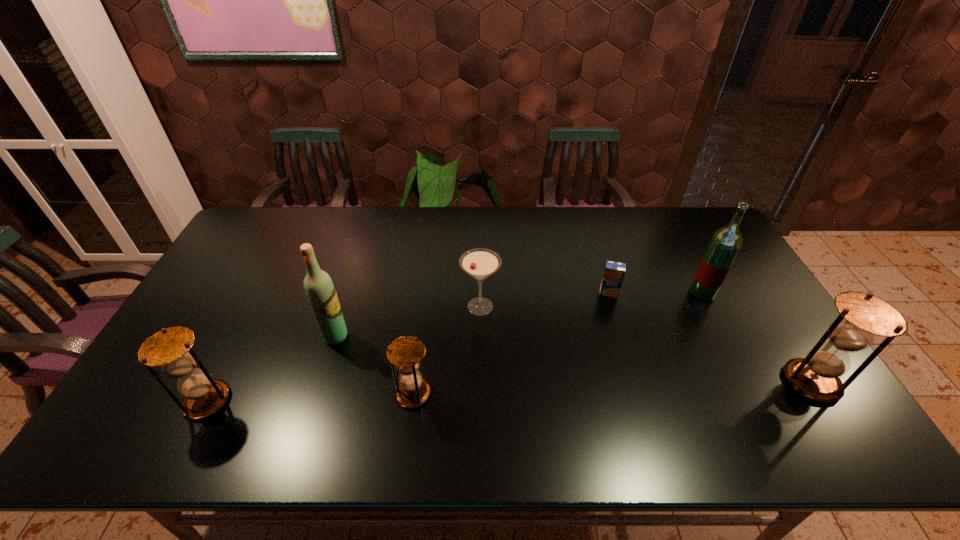
Find the location of a particular element. This screenshot has height=540, width=960. vacant region between the leftmost hourglass and the rightmost object is located at coordinates (510, 391).

I want to click on object that is the fourth closest one to the orange_juice, so click(x=405, y=353).

Locate which object is the fourth closest to the wine bottle. Please provide its 2D coordinates. Your answer should be formatted as a tuple, i.e. [(x, y)], where the tuple contains the x and y coordinates of a point satisfying the conditions above.

[(614, 272)]

You are a GUI agent. You are given a task and a screenshot of the screen. Output one action in this format:
    pyautogui.click(x=<x>, y=<y>)
    Task: Click on the closest hourglass to the fifth object from right to left
    The width and height of the screenshot is (960, 540).
    Given the screenshot: What is the action you would take?
    pyautogui.click(x=170, y=348)

Locate which hourglass is the closest to the second hourglass from left to right. Please provide its 2D coordinates. Your answer should be formatted as a tuple, i.e. [(x, y)], where the tuple contains the x and y coordinates of a point satisfying the conditions above.

[(170, 348)]

The width and height of the screenshot is (960, 540). I want to click on free space that satisfies the following two spatial constraints: 1. on the front side of the liquor; 2. on the front-facing side of the wine bottle, so click(x=725, y=336).

Identify the location of free space that satisfies the following two spatial constraints: 1. on the front side of the sixth object from left to right; 2. on the front-facing side of the wine bottle. This screenshot has width=960, height=540. tap(725, 336).

What are the coordinates of `vacant point that satisfies the following two spatial constraints: 1. on the back side of the second object from right to left; 2. on the left side of the second shortest hourglass` in the screenshot? It's located at (262, 293).

Identify the location of vacant space that satisfies the following two spatial constraints: 1. on the back side of the second hourglass from left to right; 2. on the front-facing side of the sixth object from right to left. The image size is (960, 540). (420, 336).